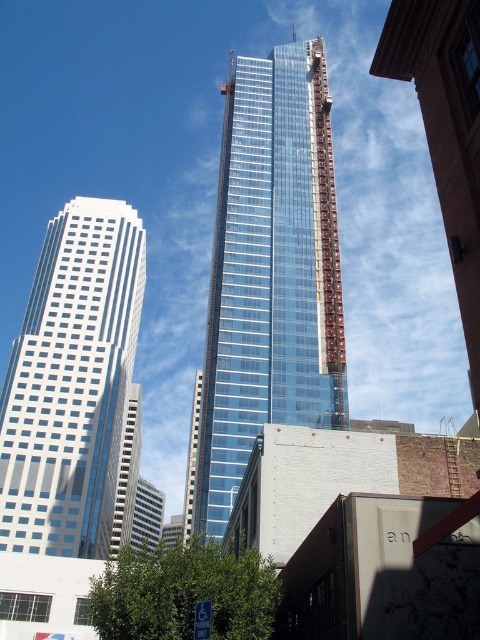
Question: From the image, what is the correct spatial relationship of transparent glass tower at center in relation to white glass building at left?

Choices:
 (A) left
 (B) right

Answer: (B)

Question: Which point is farther to the camera?

Choices:
 (A) (340, 362)
 (B) (29, 353)

Answer: (B)

Question: Is transparent glass tower at center to the left of white glass building at left from the viewer's perspective?

Choices:
 (A) yes
 (B) no

Answer: (B)

Question: Is transparent glass tower at center above white glass building at left?

Choices:
 (A) yes
 (B) no

Answer: (A)